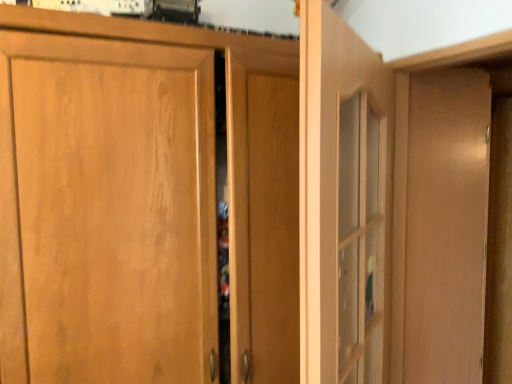
Measure the distance between matte wood dresser at right and camera.

matte wood dresser at right and camera are 32.66 inches apart from each other.

Locate an element on the screen. The width and height of the screenshot is (512, 384). wooden cabinet door at center, the second door viewed from the right is located at coordinates (106, 212).

Between point (386, 140) and point (357, 222), which one is positioned in front?

The point (357, 222) is closer.

From the image's perspective, which is above, clear glass door at center, the first door from the right, or matte wood dresser at right?

matte wood dresser at right is shown above in the image.

Is matte wood dresser at right at the back of clear glass door at center, the first door from the right?

That's right, clear glass door at center, the first door from the right, is facing away from matte wood dresser at right.

Is clear glass door at center, the second door viewed from the left, positioned beyond the bounds of matte wood dresser at right?

Yes, clear glass door at center, the second door viewed from the left, is located beyond the bounds of matte wood dresser at right.

From the image's perspective, who appears lower, matte wood dresser at right or wooden cabinet door at center, the second door viewed from the right?

From the image's view, wooden cabinet door at center, the second door viewed from the right, is below.

Is matte wood dresser at right facing towards wooden cabinet door at center, marked as the first door in a left-to-right arrangement?

No, matte wood dresser at right does not turn towards wooden cabinet door at center, marked as the first door in a left-to-right arrangement.

Can you confirm if matte wood dresser at right is taller than wooden cabinet door at center, marked as the first door in a left-to-right arrangement?

No, matte wood dresser at right is not taller than wooden cabinet door at center, marked as the first door in a left-to-right arrangement.

Which is in front, matte wood dresser at right or wooden cabinet door at center, marked as the first door in a left-to-right arrangement?

wooden cabinet door at center, marked as the first door in a left-to-right arrangement.

Does wooden cabinet door at center, the second door viewed from the right, have a lesser height compared to matte wood dresser at right?

No.

Is wooden cabinet door at center, marked as the first door in a left-to-right arrangement, not near matte wood dresser at right?

That's not correct — wooden cabinet door at center, marked as the first door in a left-to-right arrangement, is a little close to matte wood dresser at right.

Is wooden cabinet door at center, marked as the first door in a left-to-right arrangement, outside of matte wood dresser at right?

wooden cabinet door at center, marked as the first door in a left-to-right arrangement, is positioned outside matte wood dresser at right.

From a real-world perspective, is matte wood dresser at right positioned above or below clear glass door at center, the second door viewed from the left?

In terms of real-world spatial position, matte wood dresser at right is below clear glass door at center, the second door viewed from the left.

Is clear glass door at center, the first door from the right, at the back of matte wood dresser at right?

Yes, matte wood dresser at right is positioned with its back facing clear glass door at center, the first door from the right.

From the image's perspective, is matte wood dresser at right below clear glass door at center, the second door viewed from the left?

No, from the image's perspective, matte wood dresser at right is not beneath clear glass door at center, the second door viewed from the left.

Is matte wood dresser at right touching clear glass door at center, the first door from the right?

No, matte wood dresser at right is not next to clear glass door at center, the first door from the right.

This screenshot has width=512, height=384. I want to click on door in front of the wooden cabinet door at center, the second door viewed from the right, so click(343, 202).

Is clear glass door at center, the first door from the right, turned away from wooden cabinet door at center, marked as the first door in a left-to-right arrangement?

Yes, wooden cabinet door at center, marked as the first door in a left-to-right arrangement, is at the back of clear glass door at center, the first door from the right.

Looking at this image, is wooden cabinet door at center, marked as the first door in a left-to-right arrangement, completely or partially inside clear glass door at center, the first door from the right?

Definitely not — wooden cabinet door at center, marked as the first door in a left-to-right arrangement, is not inside clear glass door at center, the first door from the right.

Is point (308, 271) farther from viewer compared to point (18, 169)?

That is False.

The height and width of the screenshot is (384, 512). I want to click on door on the left side of clear glass door at center, the second door viewed from the left, so click(x=106, y=212).

Could you tell me if wooden cabinet door at center, marked as the first door in a left-to-right arrangement, is turned towards clear glass door at center, the first door from the right?

Yes, wooden cabinet door at center, marked as the first door in a left-to-right arrangement, is aimed at clear glass door at center, the first door from the right.

Choose the correct answer: Is wooden cabinet door at center, marked as the first door in a left-to-right arrangement, inside clear glass door at center, the second door viewed from the left, or outside it?

wooden cabinet door at center, marked as the first door in a left-to-right arrangement, lies outside clear glass door at center, the second door viewed from the left.

From a real-world perspective, is wooden cabinet door at center, the second door viewed from the right, over clear glass door at center, the first door from the right?

Incorrect, from a real-world perspective, wooden cabinet door at center, the second door viewed from the right, is lower than clear glass door at center, the first door from the right.

In order to click on door above the matte wood dresser at right (from a real-world perspective) in this screenshot , I will do `click(343, 202)`.

This screenshot has height=384, width=512. Find the location of `the 1st door in front when counting from the matte wood dresser at right`. the 1st door in front when counting from the matte wood dresser at right is located at coordinates (106, 212).

Looking at the image, which one is located further to matte wood dresser at right, wooden cabinet door at center, the second door viewed from the right, or clear glass door at center, the first door from the right?

wooden cabinet door at center, the second door viewed from the right.

Estimate the real-world distances between objects in this image. Which object is closer to matte wood dresser at right, clear glass door at center, the first door from the right, or wooden cabinet door at center, marked as the first door in a left-to-right arrangement?

The object closer to matte wood dresser at right is clear glass door at center, the first door from the right.

Based on the photo, which object lies nearer to the anchor point clear glass door at center, the first door from the right, wooden cabinet door at center, marked as the first door in a left-to-right arrangement, or matte wood dresser at right?

Among the two, matte wood dresser at right is located nearer to clear glass door at center, the first door from the right.

Considering their positions, is matte wood dresser at right positioned further to clear glass door at center, the second door viewed from the left, than wooden cabinet door at center, the second door viewed from the right?

wooden cabinet door at center, the second door viewed from the right, is positioned further to the anchor clear glass door at center, the second door viewed from the left.

Consider the image. From the image, which object appears to be farther from wooden cabinet door at center, the second door viewed from the right, matte wood dresser at right or clear glass door at center, the second door viewed from the left?

Based on the image, matte wood dresser at right appears to be further to wooden cabinet door at center, the second door viewed from the right.

Which object lies nearer to the anchor point wooden cabinet door at center, marked as the first door in a left-to-right arrangement, clear glass door at center, the second door viewed from the left, or matte wood dresser at right?

Based on the image, clear glass door at center, the second door viewed from the left, appears to be nearer to wooden cabinet door at center, marked as the first door in a left-to-right arrangement.

Locate an element on the screen. This screenshot has width=512, height=384. door between wooden cabinet door at center, the second door viewed from the right, and matte wood dresser at right is located at coordinates (343, 202).